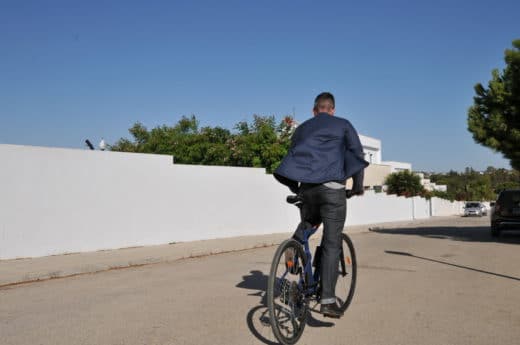
I want to click on seat, so click(297, 202).